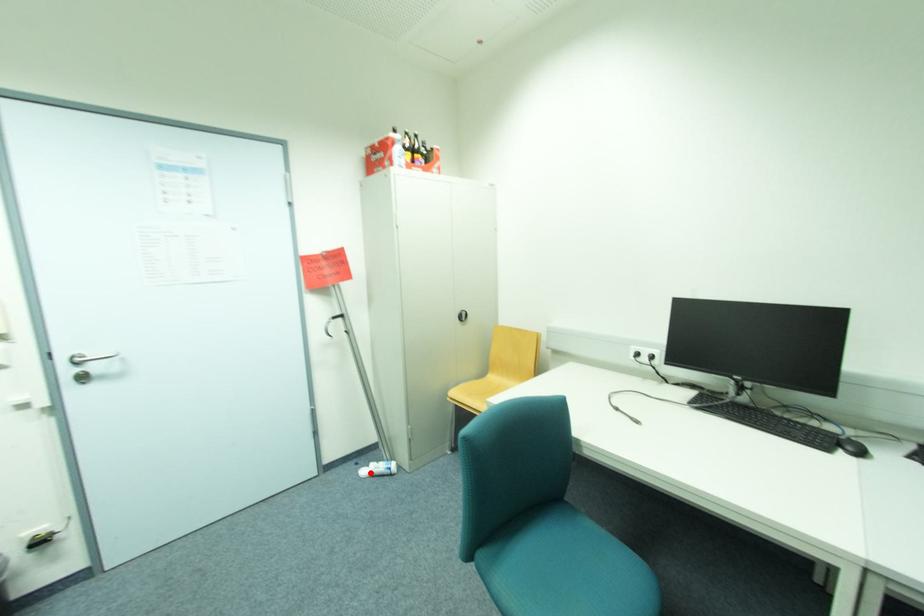
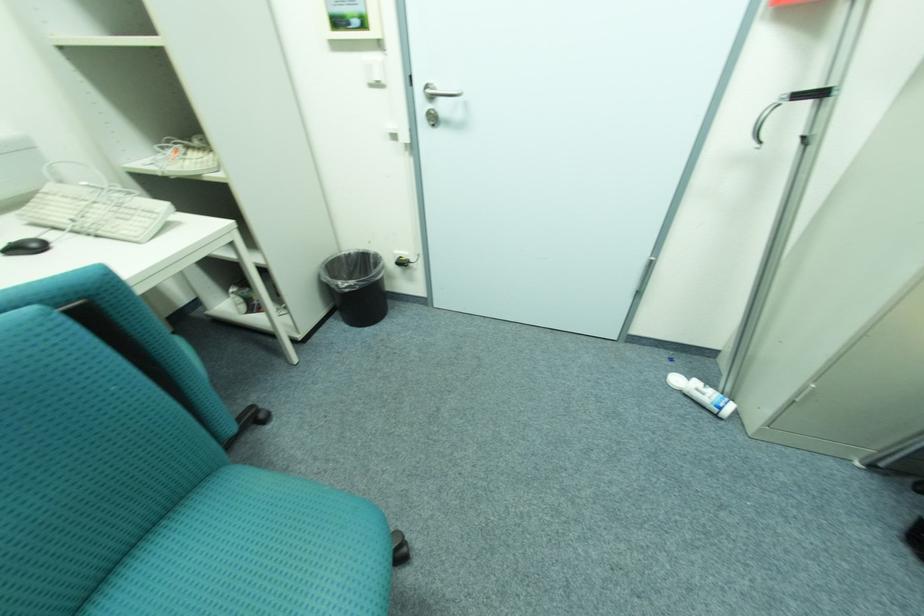
The point at the highlighted location is marked in the first image. Where is the corresponding point in the second image?

(683, 381)